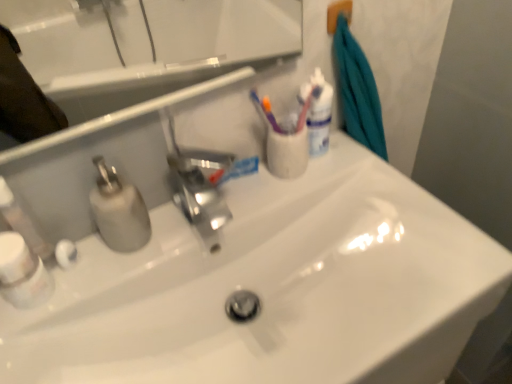
Find the location of a particular element. This screenshot has width=512, height=384. free space that is in between white glossy toothpaste at center and white plastic bottle at lower left, arranged as the first mouthwash when ordered from the bottom is located at coordinates (148, 237).